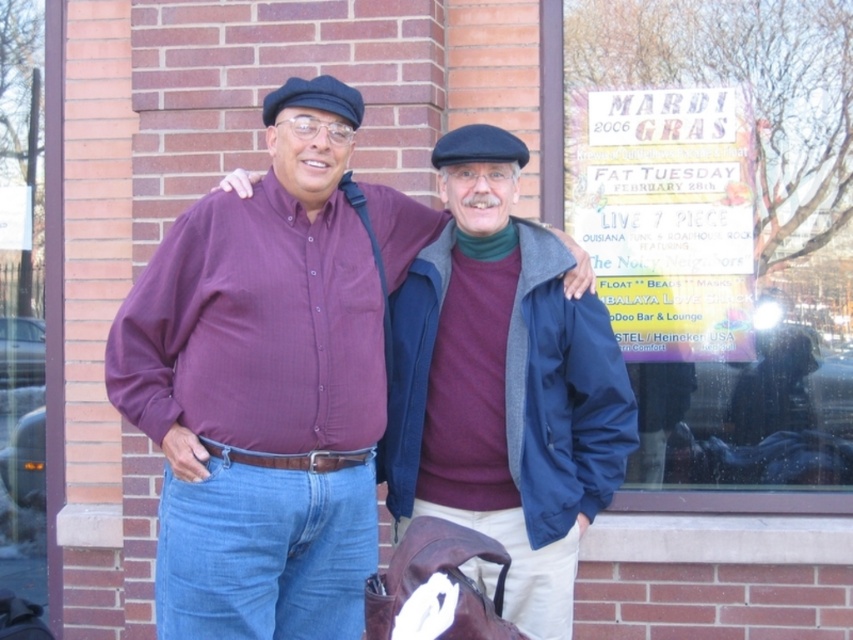
From the picture: Which of these two, matte purple shirt at center or maroon sweater at center, stands taller?

matte purple shirt at center is taller.

Measure the distance from matte purple shirt at center to maroon sweater at center.

They are 16.00 inches apart.

Identify the location of matte purple shirt at center. (262, 388).